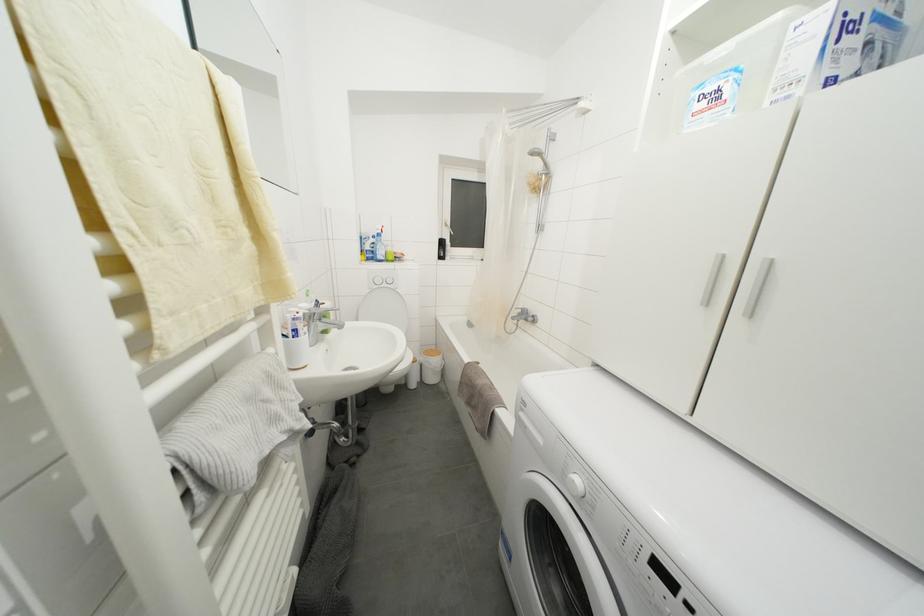
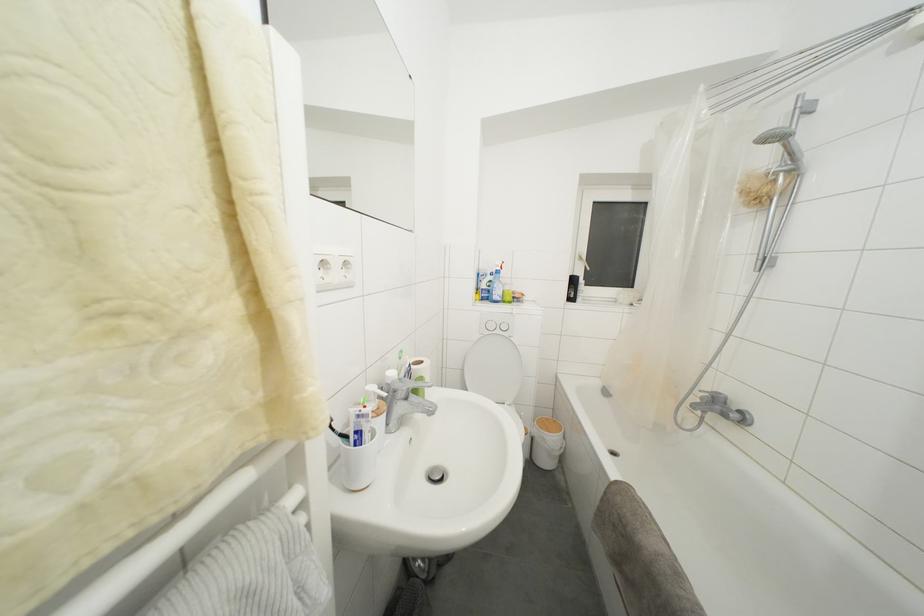
Find the pixel in the second image that matches pixel 398 294 in the first image.

(513, 344)